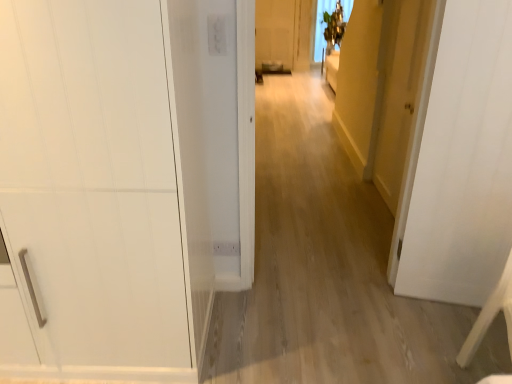
The height and width of the screenshot is (384, 512). I want to click on white matte door at center, marked as the second door in a left-to-right arrangement, so click(x=463, y=162).

From a real-world perspective, is yellow matte door at right, marked as the 3th door in a left-to-right arrangement, positioned under white wood chair at lower right based on gravity?

Incorrect, from a real-world perspective, yellow matte door at right, marked as the 3th door in a left-to-right arrangement, is higher than white wood chair at lower right.

Is white wood chair at lower right at the back of yellow matte door at right, the first door when ordered from right to left?

No.

Which is in front, point (396, 76) or point (500, 293)?

The point (500, 293) is more forward.

Can you confirm if yellow matte door at right, the first door when ordered from right to left, is smaller than white wood chair at lower right?

Yes.

Which point is more distant from viewer, (509, 292) or (467, 223)?

Positioned behind is point (467, 223).

Who is more distant, white wood chair at lower right or white matte door at center, marked as the second door in a left-to-right arrangement?

white matte door at center, marked as the second door in a left-to-right arrangement, is more distant.

Who is shorter, white wood chair at lower right or white matte door at center, marked as the second door in a left-to-right arrangement?

Standing shorter between the two is white wood chair at lower right.

Consider the image. Is white wood chair at lower right next to white matte door at center, marked as the second door in a left-to-right arrangement, and touching it?

No, white wood chair at lower right is not with white matte door at center, marked as the second door in a left-to-right arrangement.

From the image's perspective, which object appears higher, white wood chair at lower right or yellow matte door at right, the first door when ordered from right to left?

yellow matte door at right, the first door when ordered from right to left, appears higher in the image.

Is white wood chair at lower right to the right of yellow matte door at right, marked as the 3th door in a left-to-right arrangement, from the viewer's perspective?

No, white wood chair at lower right is not to the right of yellow matte door at right, marked as the 3th door in a left-to-right arrangement.

Considering the sizes of objects white wood chair at lower right and yellow matte door at right, marked as the 3th door in a left-to-right arrangement, in the image provided, who is shorter, white wood chair at lower right or yellow matte door at right, marked as the 3th door in a left-to-right arrangement,?

white wood chair at lower right.

From a real-world perspective, does yellow matte door at right, the first door when ordered from right to left, stand above white matte door at center, marked as the second door in a left-to-right arrangement?

Actually, yellow matte door at right, the first door when ordered from right to left, is physically below white matte door at center, marked as the second door in a left-to-right arrangement, in the real world.

Which object is thinner, yellow matte door at right, the first door when ordered from right to left, or white matte door at center, the second door viewed from the right?

yellow matte door at right, the first door when ordered from right to left, is thinner.

Could you measure the distance between yellow matte door at right, the first door when ordered from right to left, and white matte door at center, marked as the second door in a left-to-right arrangement?

yellow matte door at right, the first door when ordered from right to left, is 24.10 inches away from white matte door at center, marked as the second door in a left-to-right arrangement.

Is point (401, 96) closer or farther from the camera than point (438, 283)?

Clearly, point (401, 96) is more distant from the camera than point (438, 283).

From a real-world perspective, who is located lower, white wood chair at lower right or white matte cabinet at left, the 3th door in the right-to-left sequence?

In real-world perspective, white wood chair at lower right is lower.

From the picture: How much distance is there between white wood chair at lower right and white matte cabinet at left, acting as the first door starting from the left?

A distance of 4.38 feet exists between white wood chair at lower right and white matte cabinet at left, acting as the first door starting from the left.

From the image's perspective, which one is positioned lower, white wood chair at lower right or white matte cabinet at left, the 3th door in the right-to-left sequence?

white wood chair at lower right is shown below in the image.

How many degrees apart are the facing directions of white wood chair at lower right and white matte cabinet at left, acting as the first door starting from the left?

The angular difference between white wood chair at lower right and white matte cabinet at left, acting as the first door starting from the left, is 18.8 degrees.

Is white matte cabinet at left, the 3th door in the right-to-left sequence, turned away from yellow matte door at right, marked as the 3th door in a left-to-right arrangement?

No.

Is white matte cabinet at left, the 3th door in the right-to-left sequence, inside or outside of yellow matte door at right, the first door when ordered from right to left?

white matte cabinet at left, the 3th door in the right-to-left sequence, is not enclosed by yellow matte door at right, the first door when ordered from right to left.

Can you tell me how much white matte cabinet at left, the 3th door in the right-to-left sequence, and yellow matte door at right, marked as the 3th door in a left-to-right arrangement, differ in facing direction?

The facing directions of white matte cabinet at left, the 3th door in the right-to-left sequence, and yellow matte door at right, marked as the 3th door in a left-to-right arrangement, are 90.1 degrees apart.

Is the position of white matte cabinet at left, acting as the first door starting from the left, less distant than that of yellow matte door at right, the first door when ordered from right to left?

Yes, white matte cabinet at left, acting as the first door starting from the left, is closer to the viewer.

Which object is more forward, white matte door at center, the second door viewed from the right, or yellow matte door at right, the first door when ordered from right to left?

white matte door at center, the second door viewed from the right.

Considering the positions of objects white matte door at center, the second door viewed from the right, and yellow matte door at right, marked as the 3th door in a left-to-right arrangement, in the image provided, who is more to the left, white matte door at center, the second door viewed from the right, or yellow matte door at right, marked as the 3th door in a left-to-right arrangement,?

white matte door at center, the second door viewed from the right, is more to the left.

Considering the sizes of objects white matte door at center, marked as the second door in a left-to-right arrangement, and yellow matte door at right, marked as the 3th door in a left-to-right arrangement, in the image provided, who is wider, white matte door at center, marked as the second door in a left-to-right arrangement, or yellow matte door at right, marked as the 3th door in a left-to-right arrangement,?

white matte door at center, marked as the second door in a left-to-right arrangement, is wider.

Starting from the yellow matte door at right, marked as the 3th door in a left-to-right arrangement, which door is the 1st one in front? Please provide its 2D coordinates.

[(463, 162)]

You are a GUI agent. You are given a task and a screenshot of the screen. Output one action in this format:
    pyautogui.click(x=<x>, y=<y>)
    Task: Click on the furniture located below the yellow matte door at right, the first door when ordered from right to left (from the image's perspective)
    The width and height of the screenshot is (512, 384).
    Given the screenshot: What is the action you would take?
    pyautogui.click(x=490, y=316)

I want to click on furniture on the left side of white matte door at center, marked as the second door in a left-to-right arrangement, so pyautogui.click(x=490, y=316).

Considering their positions, is white wood chair at lower right positioned closer to white matte cabinet at left, the 3th door in the right-to-left sequence, than white matte door at center, the second door viewed from the right?

white matte door at center, the second door viewed from the right.

Which object lies nearer to the anchor point yellow matte door at right, the first door when ordered from right to left, white matte cabinet at left, acting as the first door starting from the left, or white wood chair at lower right?

Among the two, white wood chair at lower right is located nearer to yellow matte door at right, the first door when ordered from right to left.

Which object lies nearer to the anchor point yellow matte door at right, marked as the 3th door in a left-to-right arrangement, white wood chair at lower right or white matte cabinet at left, the 3th door in the right-to-left sequence?

The object closer to yellow matte door at right, marked as the 3th door in a left-to-right arrangement, is white wood chair at lower right.

Which object lies further to the anchor point yellow matte door at right, marked as the 3th door in a left-to-right arrangement, white matte door at center, marked as the second door in a left-to-right arrangement, or white matte cabinet at left, acting as the first door starting from the left?

Among the two, white matte cabinet at left, acting as the first door starting from the left, is located further to yellow matte door at right, marked as the 3th door in a left-to-right arrangement.

Based on their spatial positions, is white matte door at center, marked as the second door in a left-to-right arrangement, or yellow matte door at right, marked as the 3th door in a left-to-right arrangement, closer to white wood chair at lower right?

white matte door at center, marked as the second door in a left-to-right arrangement, is closer to white wood chair at lower right.

Considering their positions, is yellow matte door at right, the first door when ordered from right to left, positioned further to white matte door at center, the second door viewed from the right, than white wood chair at lower right?

Based on the image, yellow matte door at right, the first door when ordered from right to left, appears to be further to white matte door at center, the second door viewed from the right.

Considering their positions, is white matte cabinet at left, the 3th door in the right-to-left sequence, positioned closer to white matte door at center, the second door viewed from the right, than white wood chair at lower right?

white wood chair at lower right is closer to white matte door at center, the second door viewed from the right.

Which object lies further to the anchor point white matte door at center, marked as the second door in a left-to-right arrangement, yellow matte door at right, marked as the 3th door in a left-to-right arrangement, or white matte cabinet at left, acting as the first door starting from the left?

white matte cabinet at left, acting as the first door starting from the left.

Where is `furniture situated between white matte cabinet at left, the 3th door in the right-to-left sequence, and yellow matte door at right, marked as the 3th door in a left-to-right arrangement, from left to right`? The image size is (512, 384). furniture situated between white matte cabinet at left, the 3th door in the right-to-left sequence, and yellow matte door at right, marked as the 3th door in a left-to-right arrangement, from left to right is located at coordinates (490, 316).

At what (x,y) coordinates should I click in order to perform the action: click on furniture between white matte cabinet at left, acting as the first door starting from the left, and white matte door at center, the second door viewed from the right. Please return your answer as a coordinate pair (x, y). This screenshot has width=512, height=384. Looking at the image, I should click on (490, 316).

At what (x,y) coordinates should I click in order to perform the action: click on door located between white matte cabinet at left, acting as the first door starting from the left, and yellow matte door at right, marked as the 3th door in a left-to-right arrangement, in the left-right direction. Please return your answer as a coordinate pair (x, y). Image resolution: width=512 pixels, height=384 pixels. Looking at the image, I should click on (463, 162).